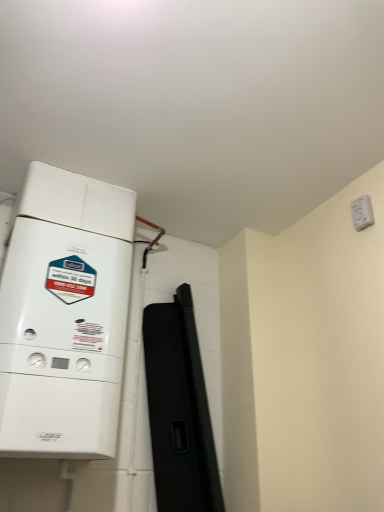
This screenshot has height=512, width=384. I want to click on white matte boiler at left, so click(65, 316).

The height and width of the screenshot is (512, 384). Describe the element at coordinates (65, 316) in the screenshot. I see `white matte boiler at left` at that location.

Where is `white plastic switch at upper right`? This screenshot has width=384, height=512. white plastic switch at upper right is located at coordinates (362, 213).

Measure the distance between white plastic switch at upper right and camera.

white plastic switch at upper right and camera are 4.61 feet apart from each other.

Measure the distance between point (370, 215) and camera.

Point (370, 215) and camera are 1.42 meters apart.

Describe the element at coordinates (362, 213) in the screenshot. Image resolution: width=384 pixels, height=512 pixels. I see `white plastic switch at upper right` at that location.

Locate an element on the screen. The image size is (384, 512). white matte boiler at left is located at coordinates (65, 316).

From the picture: Can you confirm if white matte boiler at left is positioned to the right of white plastic switch at upper right?

No.

Which object is closer to the camera taking this photo, white matte boiler at left or white plastic switch at upper right?

white matte boiler at left is closer to the camera.

Does point (106, 289) lie behind point (358, 231)?

No, (106, 289) is closer to viewer.

From the image's perspective, is white matte boiler at left below white plastic switch at upper right?

Correct, white matte boiler at left appears lower than white plastic switch at upper right in the image.

From a real-world perspective, is white matte boiler at left over white plastic switch at upper right?

Actually, white matte boiler at left is physically below white plastic switch at upper right in the real world.

Considering the sizes of objects white matte boiler at left and white plastic switch at upper right in the image provided, who is wider, white matte boiler at left or white plastic switch at upper right?

Wider between the two is white matte boiler at left.

Between white matte boiler at left and white plastic switch at upper right, which one has more height?

Standing taller between the two is white matte boiler at left.

Which of these two, white matte boiler at left or white plastic switch at upper right, is smaller?

With smaller size is white plastic switch at upper right.

Is white matte boiler at left inside the boundaries of white plastic switch at upper right, or outside?

The correct answer is: outside.

Would you consider white matte boiler at left to be distant from white plastic switch at upper right?

Indeed, white matte boiler at left is not near white plastic switch at upper right.

Is white matte boiler at left looking in the opposite direction of white plastic switch at upper right?

No, white matte boiler at left's orientation is not away from white plastic switch at upper right.

What's the angular difference between white matte boiler at left and white plastic switch at upper right's facing directions?

The facing directions of white matte boiler at left and white plastic switch at upper right are 91.7 degrees apart.

Locate an element on the screen. The height and width of the screenshot is (512, 384). home appliance that appears below the white plastic switch at upper right (from the image's perspective) is located at coordinates tap(65, 316).

Is white plastic switch at upper right to the left of white matte boiler at left from the viewer's perspective?

In fact, white plastic switch at upper right is to the right of white matte boiler at left.

Which object is further away from the camera taking this photo, white plastic switch at upper right or white matte boiler at left?

white plastic switch at upper right is behind.

Which is less distant, (358, 200) or (38, 284)?

Point (358, 200) is farther from the camera than point (38, 284).

From the image's perspective, which object appears higher, white plastic switch at upper right or white matte boiler at left?

white plastic switch at upper right.

From a real-world perspective, relative to white matte boiler at left, is white plastic switch at upper right vertically above or below?

From a real-world perspective, white plastic switch at upper right is physically above white matte boiler at left.

Which object is thinner, white plastic switch at upper right or white matte boiler at left?

With smaller width is white plastic switch at upper right.

Considering the relative sizes of white plastic switch at upper right and white matte boiler at left in the image provided, is white plastic switch at upper right shorter than white matte boiler at left?

Yes.

Who is smaller, white plastic switch at upper right or white matte boiler at left?

Smaller between the two is white plastic switch at upper right.

Is white plastic switch at upper right located outside white matte boiler at left?

white plastic switch at upper right is positioned outside white matte boiler at left.

Does white plastic switch at upper right touch white matte boiler at left?

No, white plastic switch at upper right is not beside white matte boiler at left.

Could you tell me if white plastic switch at upper right is facing white matte boiler at left?

No.

How different are the orientations of white plastic switch at upper right and white matte boiler at left in degrees?

91.7 degrees.

Where is `home appliance below the white plastic switch at upper right (from the image's perspective)`? The image size is (384, 512). home appliance below the white plastic switch at upper right (from the image's perspective) is located at coordinates (x=65, y=316).

In the image, there is a white matte boiler at left. What are the coordinates of `electric outlet above it (from the image's perspective)` in the screenshot? It's located at (362, 213).

The height and width of the screenshot is (512, 384). What are the coordinates of `home appliance that is below the white plastic switch at upper right (from the image's perspective)` in the screenshot? It's located at (65, 316).